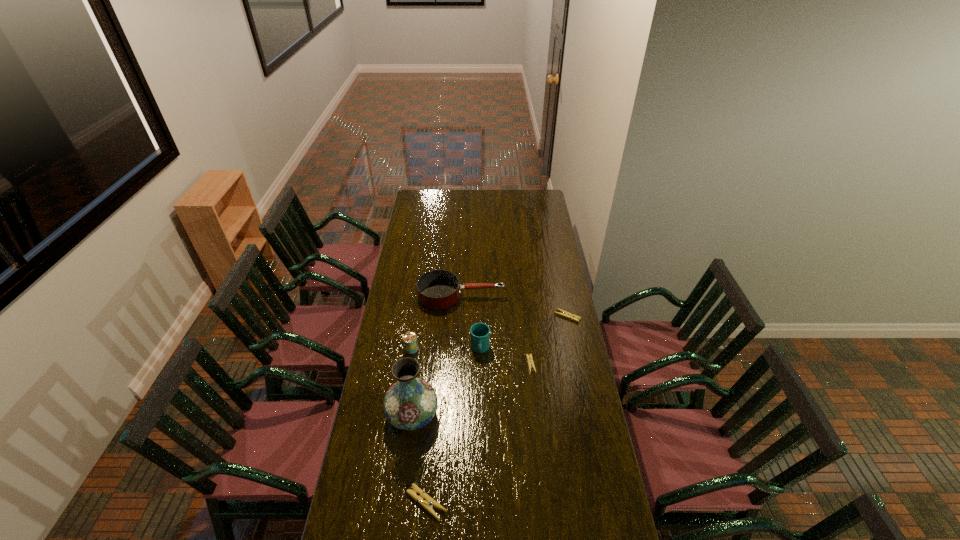
Find the location of `the nearest object`. the nearest object is located at coordinates (424, 500).

The height and width of the screenshot is (540, 960). Identify the location of the third shortest object. (424, 500).

Image resolution: width=960 pixels, height=540 pixels. I want to click on the second clothespin from left to right, so click(529, 357).

The image size is (960, 540). In order to click on the shortest clothespin in this screenshot , I will do `click(529, 357)`.

Image resolution: width=960 pixels, height=540 pixels. I want to click on the second shortest object, so click(x=563, y=313).

Locate an element on the screen. This screenshot has width=960, height=540. the farthest clothespin is located at coordinates (563, 313).

The height and width of the screenshot is (540, 960). Find the location of `cup`. cup is located at coordinates [x=479, y=332].

Where is `pan`? pan is located at coordinates (439, 289).

Locate an element on the screen. The image size is (960, 540). vase is located at coordinates (410, 403).

Find the location of `the sixth farthest object`. the sixth farthest object is located at coordinates (410, 403).